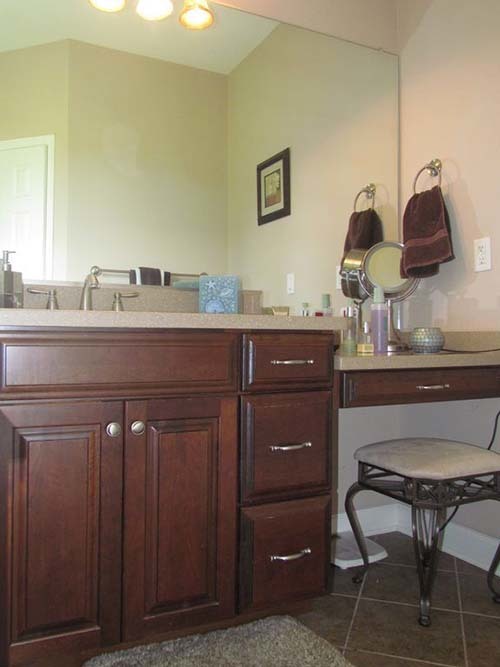
The height and width of the screenshot is (667, 500). I want to click on mirror, so click(x=382, y=259), click(x=155, y=205).